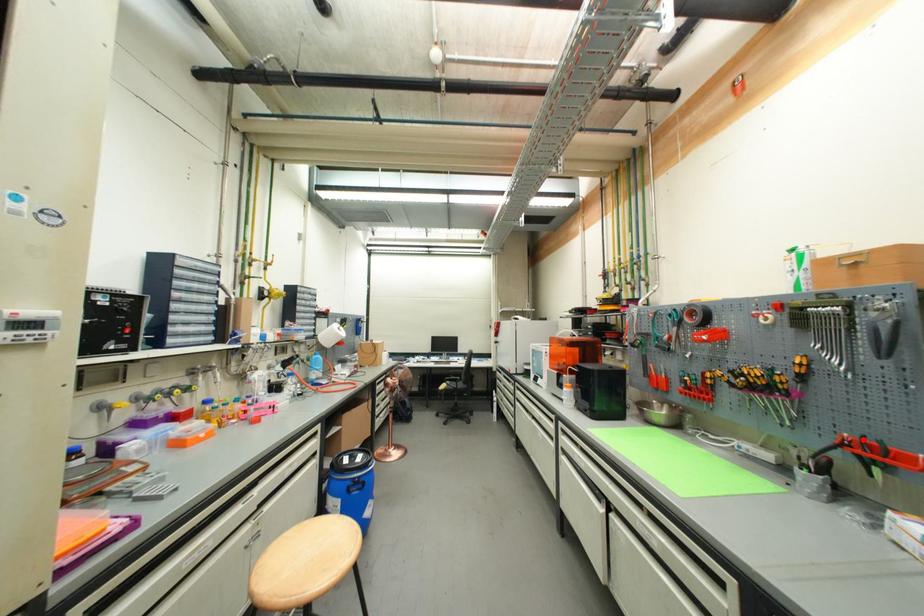
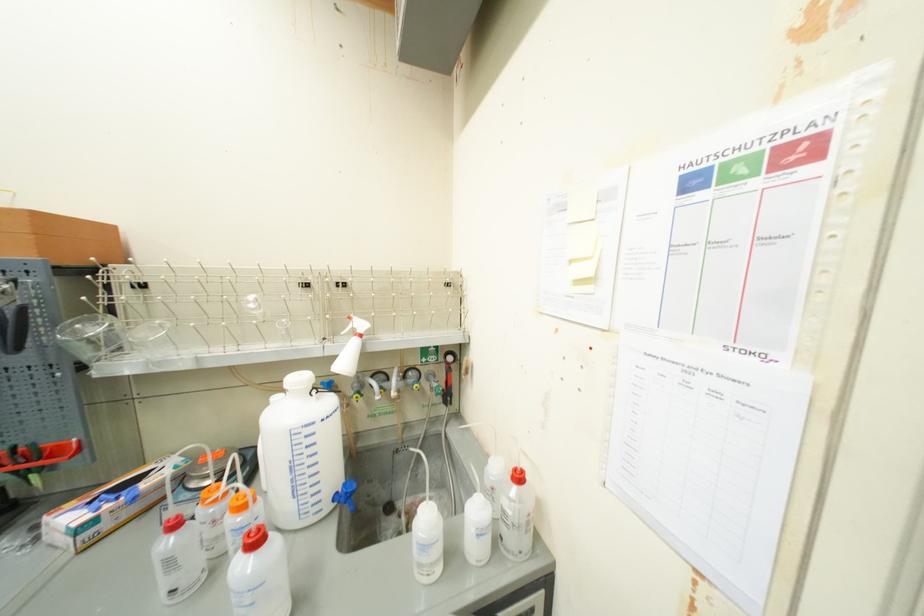
Locate, in the second image, the point that corresponds to the highlighted location in the first image.

(13, 453)